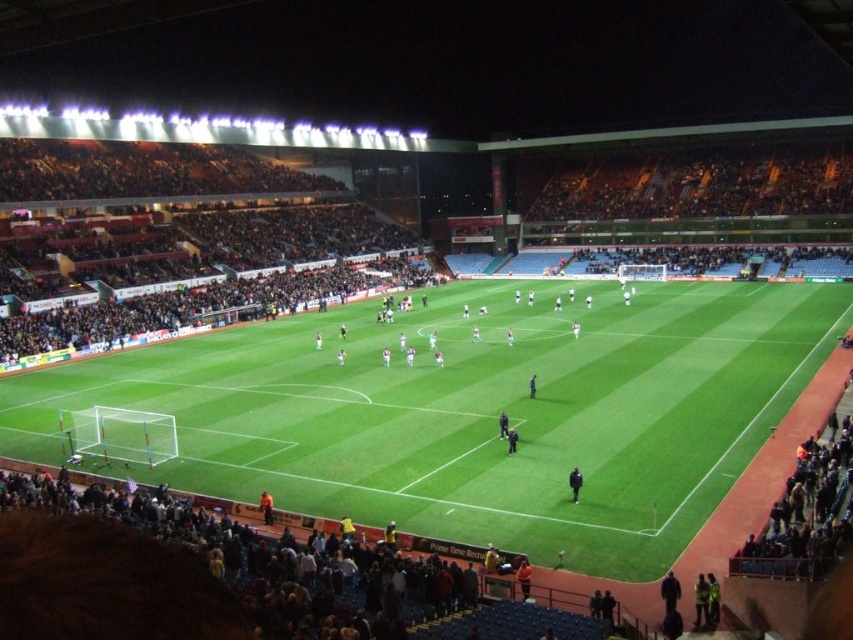
Question: Which point appears farthest from the camera in this image?

Choices:
 (A) (573, 468)
 (B) (151, 371)
 (C) (514, 428)

Answer: (B)

Question: Which object is farther from the camera taking this photo?

Choices:
 (A) black fabric person at center
 (B) dark blue uniform at center

Answer: (B)

Question: Can you confirm if green grass football field at center is positioned to the right of black fabric person at center?

Choices:
 (A) yes
 (B) no

Answer: (A)

Question: Based on their relative distances, which object is nearer to the dark blue uniform at center?

Choices:
 (A) black fabric person at center
 (B) black matte person at center

Answer: (A)

Question: Is green grass football field at center thinner than black matte person at center?

Choices:
 (A) yes
 (B) no

Answer: (B)

Question: Considering the relative positions of green grass football field at center and black fabric person at center in the image provided, where is green grass football field at center located with respect to black fabric person at center?

Choices:
 (A) above
 (B) below

Answer: (A)